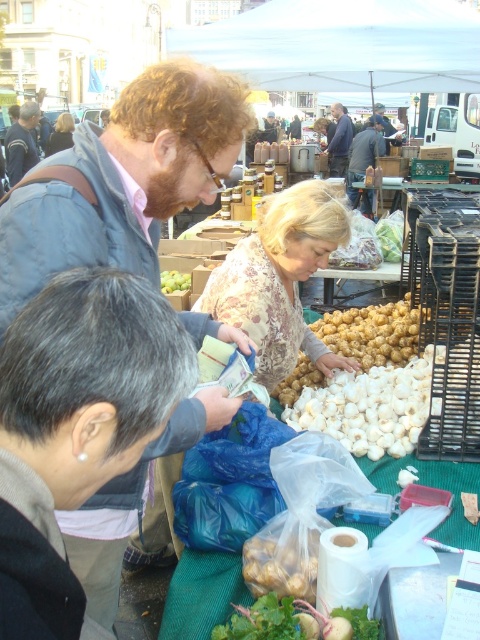
From the picture: You are a customer at the market and want to find the white fabric canopy at upper center. Which direction should you look relative to the matte brown jacket at upper left?

The white fabric canopy at upper center is to the right of the matte brown jacket at upper left, so you should look to the right of the matte brown jacket at upper left to find it.